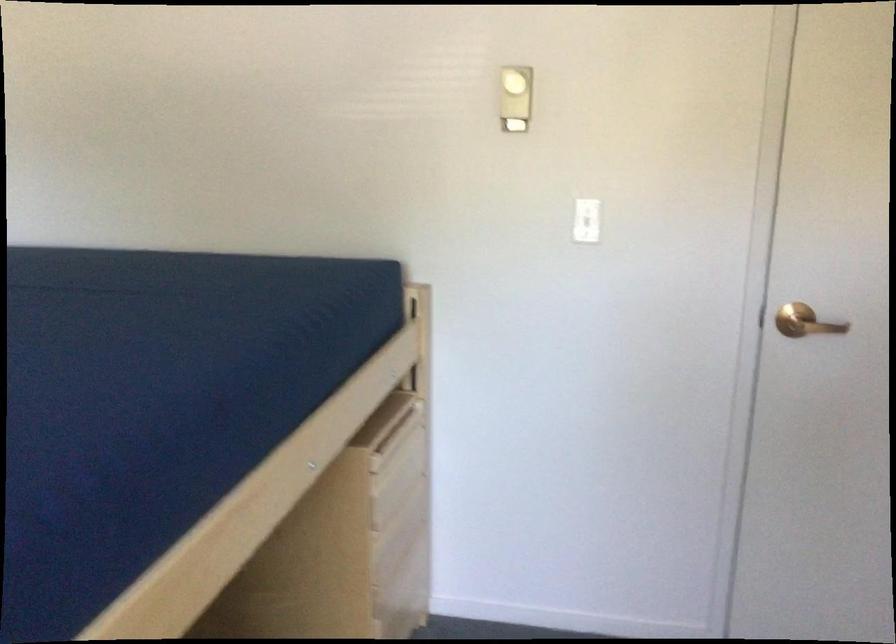
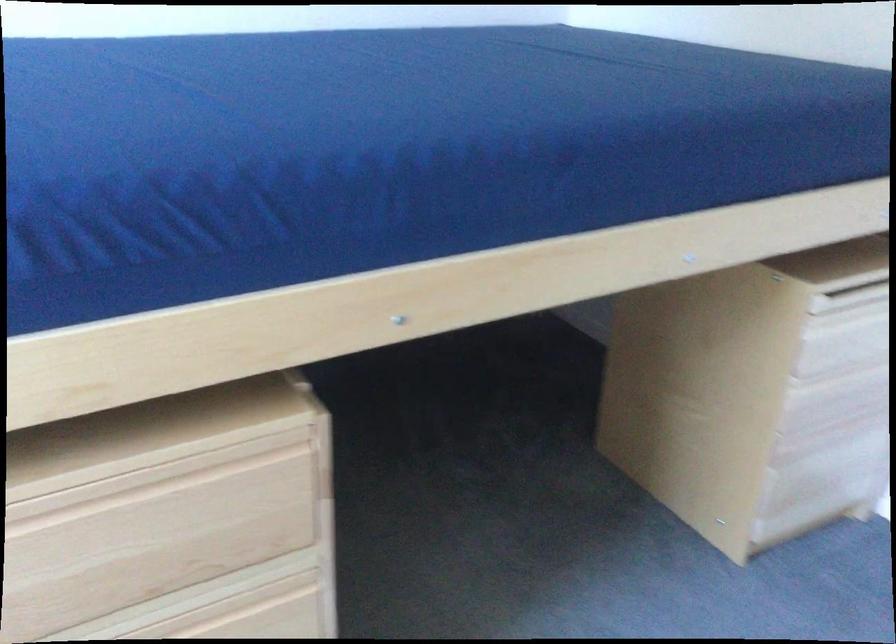
In the second image, find the point that corresponds to [400,516] in the first image.

(845, 381)